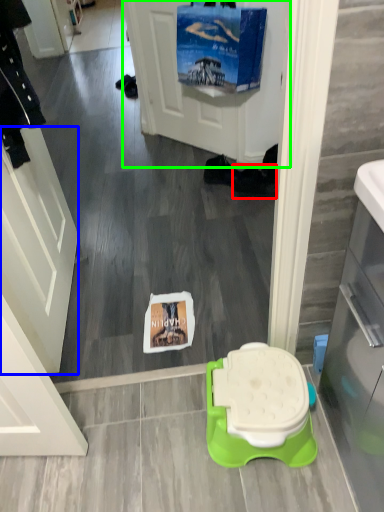
Question: Which object is the closest to the footwear (highlighted by a red box)? Choose among these: screen door (highlighted by a blue box) or screen door (highlighted by a green box).

Choices:
 (A) screen door
 (B) screen door

Answer: (B)